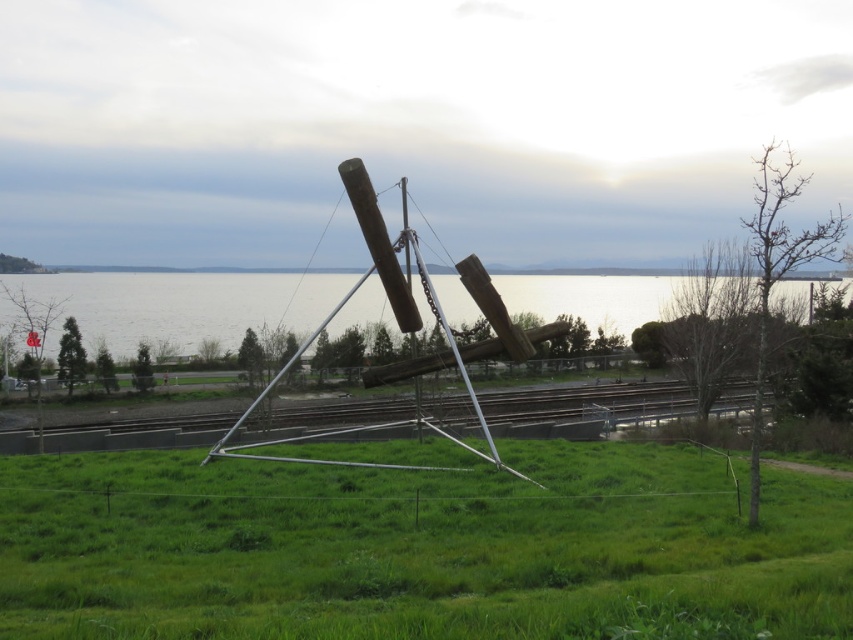
Is green grass at center thinner than transparent water at center?

Yes.

Is point (184, 454) farther from viewer compared to point (61, 298)?

No, it is in front of (61, 298).

Locate an element on the screen. Image resolution: width=853 pixels, height=640 pixels. green grass at center is located at coordinates (416, 548).

This screenshot has width=853, height=640. Identify the location of green grass at center. (416, 548).